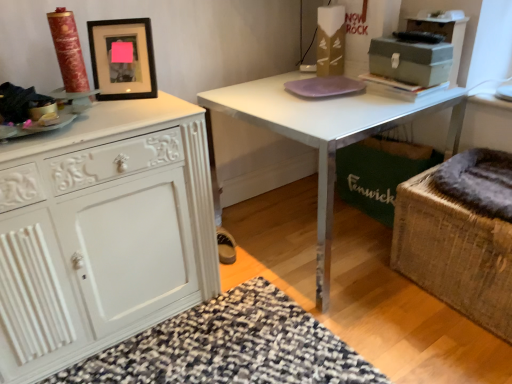
The image size is (512, 384). In order to click on vacant area that lies between white glossy table at center and rattan wicker swivel chair at lower right, the 1th swivel chair when ordered from bottom to top in this screenshot , I will do `click(387, 310)`.